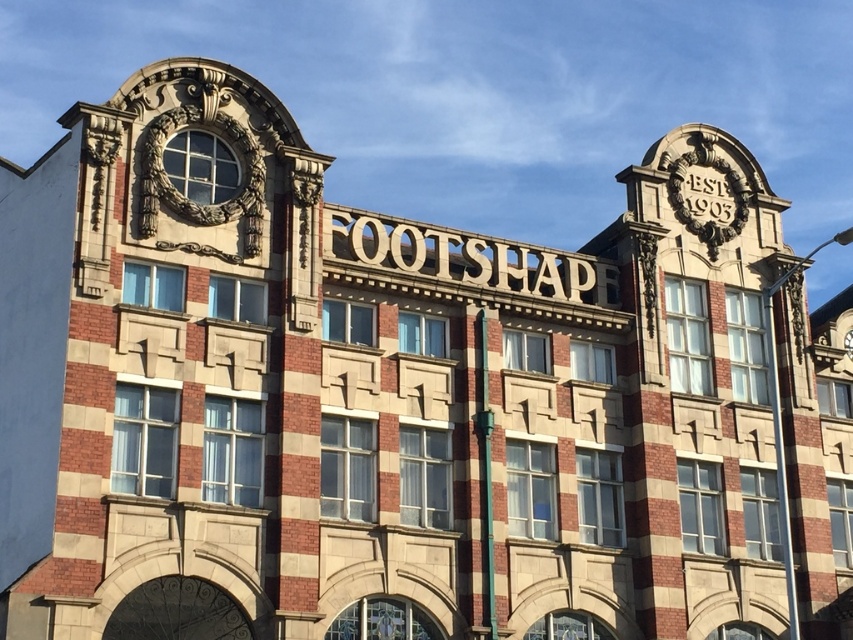
Looking at this image, is gold metallic clock at upper right bigger than gold metallic clock at upper center?

Yes, gold metallic clock at upper right is bigger than gold metallic clock at upper center.

Which of these two, gold metallic clock at upper right or gold metallic clock at upper center, stands shorter?

With less height is gold metallic clock at upper center.

At what (x,y) coordinates should I click in order to perform the action: click on gold metallic clock at upper right. Please return your answer as a coordinate pair (x, y). The width and height of the screenshot is (853, 640). Looking at the image, I should click on click(x=708, y=196).

Image resolution: width=853 pixels, height=640 pixels. I want to click on gold metallic clock at upper right, so click(708, 196).